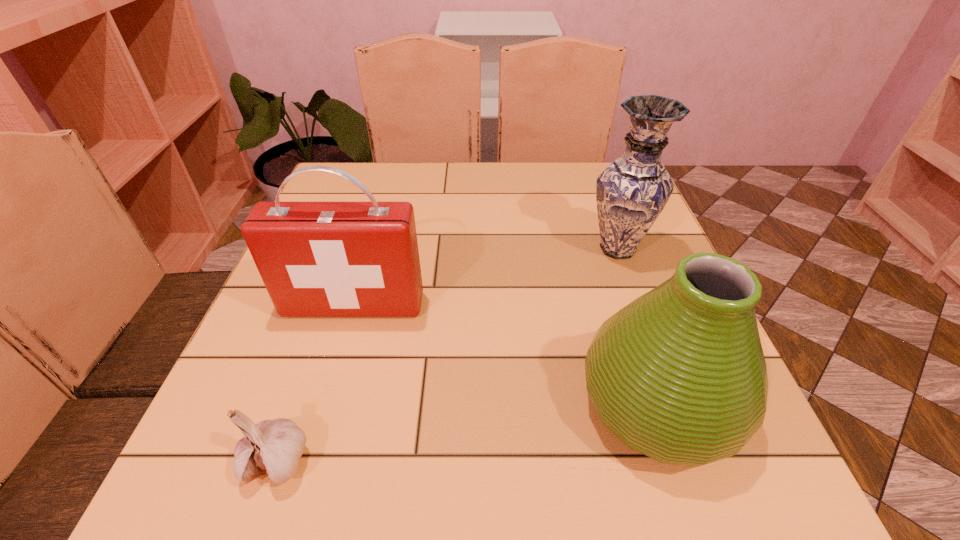
Identify the location of empty location between the farthest object and the garlic. (447, 354).

In order to click on vacant area that lies between the farther vase and the shortest object in this screenshot , I will do `click(447, 354)`.

Locate an element on the screen. Image resolution: width=960 pixels, height=540 pixels. free point between the garlic and the first-aid kit is located at coordinates (315, 382).

You are a GUI agent. You are given a task and a screenshot of the screen. Output one action in this format:
    pyautogui.click(x=<x>, y=<y>)
    Task: Click on the empty location between the first-aid kit and the garlic
    The image size is (960, 540).
    Given the screenshot: What is the action you would take?
    pyautogui.click(x=315, y=382)

Locate an element on the screen. The width and height of the screenshot is (960, 540). vacant area that lies between the shortest object and the farther vase is located at coordinates (447, 354).

Where is `empty location between the farthest object and the first-aid kit`? empty location between the farthest object and the first-aid kit is located at coordinates (486, 277).

At what (x,y) coordinates should I click in order to perform the action: click on vacant area that lies between the farther vase and the third nearest object. Please return your answer as a coordinate pair (x, y). Looking at the image, I should click on (486, 277).

Where is `free point between the second farthest object and the shorter vase`? Image resolution: width=960 pixels, height=540 pixels. free point between the second farthest object and the shorter vase is located at coordinates (505, 355).

Locate an element on the screen. Image resolution: width=960 pixels, height=540 pixels. vacant region between the second farthest object and the farthest object is located at coordinates (486, 277).

You are a GUI agent. You are given a task and a screenshot of the screen. Output one action in this format:
    pyautogui.click(x=<x>, y=<y>)
    Task: Click on the object that can be found as the second closest to the third nearest object
    The height and width of the screenshot is (540, 960).
    Given the screenshot: What is the action you would take?
    pyautogui.click(x=679, y=374)